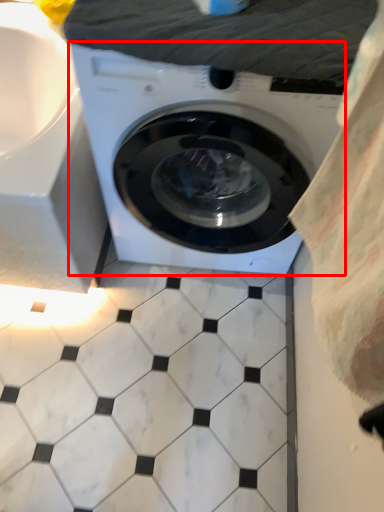
Question: In this image, where is washing machine (annotated by the red box) located relative to sheet?

Choices:
 (A) left
 (B) right

Answer: (A)